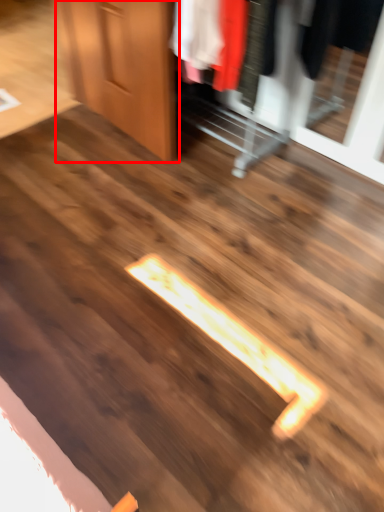
Question: Where is door (annotated by the red box) located in relation to dresser in the image?

Choices:
 (A) left
 (B) right

Answer: (A)